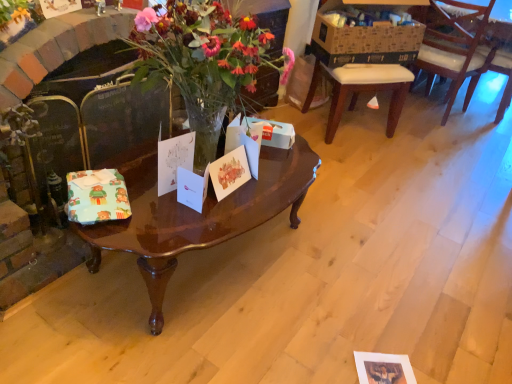
Question: Considering the relative sizes of white paper gift card at center, which is counted as the 2th gift card, starting from the right, and white paper gift card at center, acting as the second gift card starting from the left, in the image provided, is white paper gift card at center, which is counted as the 2th gift card, starting from the right, shorter than white paper gift card at center, acting as the second gift card starting from the left,?

Choices:
 (A) no
 (B) yes

Answer: (B)

Question: Is white paper gift card at center, which is counted as the 2th gift card, starting from the right, next to white paper gift card at center, acting as the second gift card starting from the left, and touching it?

Choices:
 (A) no
 (B) yes

Answer: (B)

Question: Is the position of white paper gift card at center, arranged as the third gift card when viewed from the left, more distant than that of white paper gift card at center, acting as the second gift card starting from the left?

Choices:
 (A) yes
 (B) no

Answer: (B)

Question: From a real-world perspective, is white paper gift card at center, arranged as the third gift card when viewed from the left, positioned over white paper gift card at center, arranged as the third gift card when viewed from the right, based on gravity?

Choices:
 (A) no
 (B) yes

Answer: (A)

Question: Is white paper gift card at center, arranged as the third gift card when viewed from the left, to the right of white paper gift card at center, acting as the second gift card starting from the left, from the viewer's perspective?

Choices:
 (A) no
 (B) yes

Answer: (B)

Question: In terms of size, does white paper gift card at center, the first gift card from the right, appear bigger or smaller than wooden chair at right?

Choices:
 (A) big
 (B) small

Answer: (B)

Question: In the image, is white paper gift card at center, the first gift card from the right, positioned in front of or behind wooden chair at right?

Choices:
 (A) front
 (B) behind

Answer: (A)

Question: Considering the positions of point (241, 168) and point (506, 38), is point (241, 168) closer or farther from the camera than point (506, 38)?

Choices:
 (A) closer
 (B) farther

Answer: (A)

Question: From a real-world perspective, is white paper gift card at center, the fourth gift card viewed from the left, positioned above or below wooden chair at right?

Choices:
 (A) below
 (B) above

Answer: (B)

Question: Considering their positions, is wooden chair at right located in front of or behind brown cardboard box at upper right?

Choices:
 (A) behind
 (B) front

Answer: (A)

Question: From the image's perspective, is wooden chair at right located above or below brown cardboard box at upper right?

Choices:
 (A) above
 (B) below

Answer: (A)

Question: Which is correct: wooden chair at right is inside brown cardboard box at upper right, or outside of it?

Choices:
 (A) outside
 (B) inside

Answer: (A)

Question: Looking at the image, does wooden chair at right seem bigger or smaller compared to brown cardboard box at upper right?

Choices:
 (A) big
 (B) small

Answer: (A)

Question: In terms of size, does white paper gift card at center, arranged as the third gift card when viewed from the right, appear bigger or smaller than wooden chair at right?

Choices:
 (A) big
 (B) small

Answer: (B)

Question: In terms of width, does white paper gift card at center, arranged as the third gift card when viewed from the right, look wider or thinner when compared to wooden chair at right?

Choices:
 (A) wide
 (B) thin

Answer: (B)